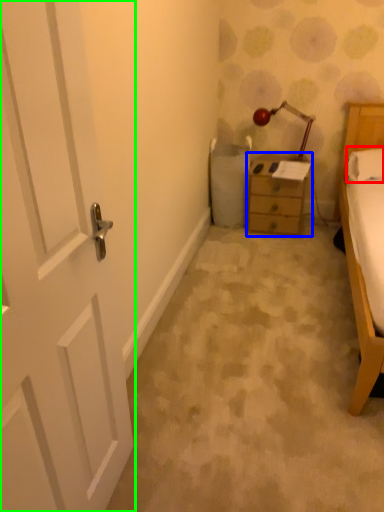
Question: Which object is the farthest from pillow (highlighted by a red box)? Choose among these: nightstand (highlighted by a blue box) or door (highlighted by a green box).

Choices:
 (A) nightstand
 (B) door

Answer: (B)